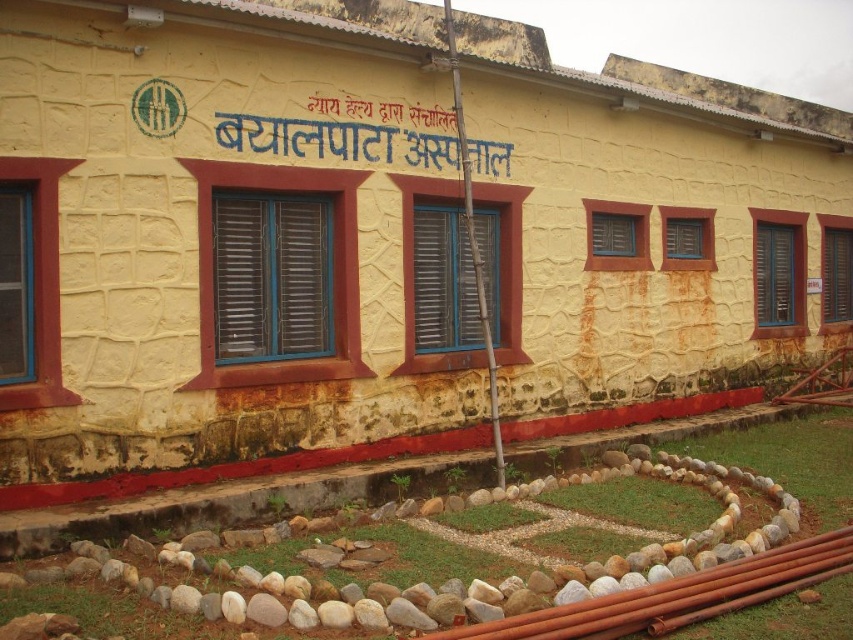
Which is behind, point (751, 604) or point (239, 131)?

The point (239, 131) is behind.

Based on the photo, is brown metallic pipes at lower right bigger than blue painted signboard at center?

No.

Is point (788, 566) more distant than point (299, 124)?

That is False.

At what (x,y) coordinates should I click in order to perform the action: click on brown metallic pipes at lower right. Please return your answer as a coordinate pair (x, y). The height and width of the screenshot is (640, 853). Looking at the image, I should click on (677, 595).